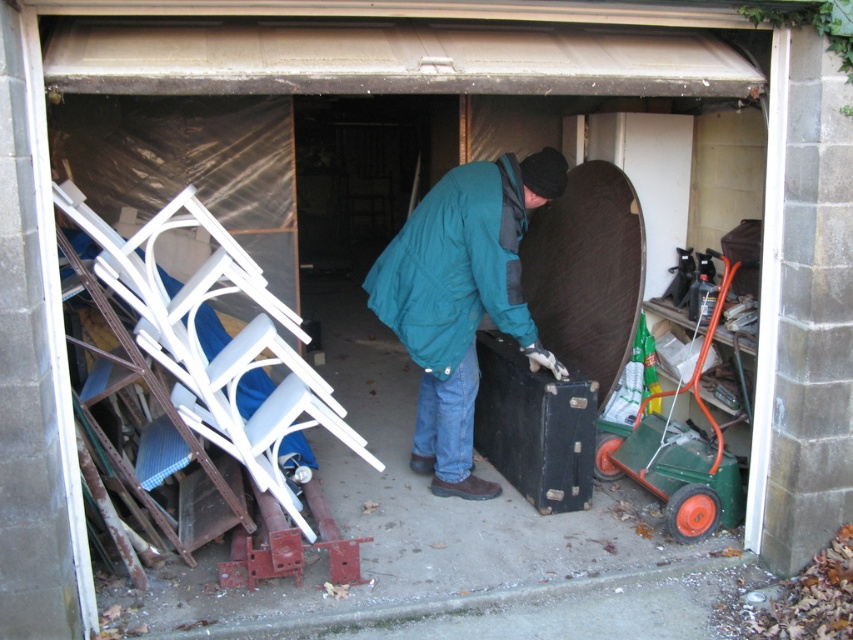
Between teal fabric jacket at center and green plastic cart at right, which one appears on the right side from the viewer's perspective?

Positioned to the right is green plastic cart at right.

Find the location of a particular element. The image size is (853, 640). teal fabric jacket at center is located at coordinates click(461, 300).

Find the location of a particular element. teal fabric jacket at center is located at coordinates (461, 300).